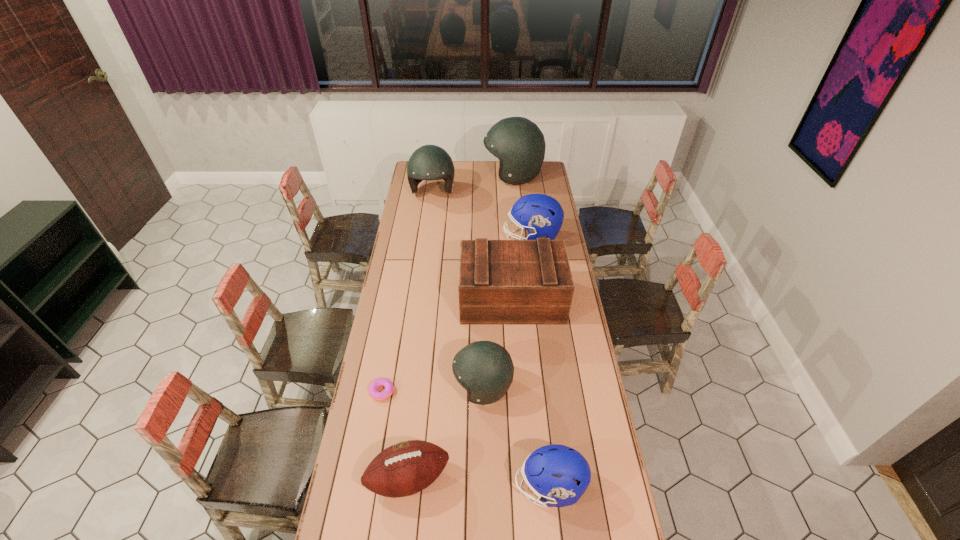
Locate an element on the screen. This screenshot has height=540, width=960. football helmet that is the third closest to the second nearest football helmet is located at coordinates (429, 162).

Locate an element on the screen. Image resolution: width=960 pixels, height=540 pixels. green football helmet that stands as the closest to the biggest green football helmet is located at coordinates (429, 162).

Identify which green football helmet is the second closest to the leftmost football helmet. Please provide its 2D coordinates. Your answer should be formatted as a tuple, i.e. [(x, y)], where the tuple contains the x and y coordinates of a point satisfying the conditions above.

[(485, 369)]

Identify the location of vacant region that satisfies the following two spatial constraints: 1. at the face opening of the tallest football helmet; 2. at the face opening of the second biggest green football helmet. The width and height of the screenshot is (960, 540). (515, 193).

Locate an element on the screen. blank area in the image that satisfies the following two spatial constraints: 1. at the face opening of the tallest football helmet; 2. on the front side of the football (American) is located at coordinates (543, 478).